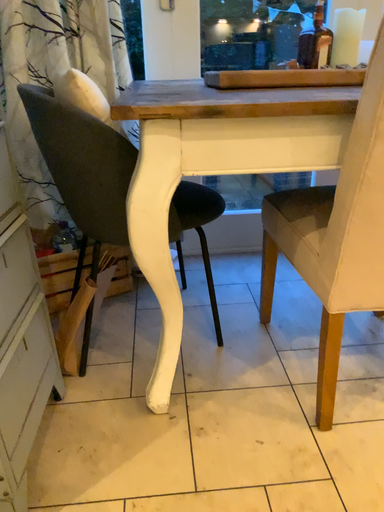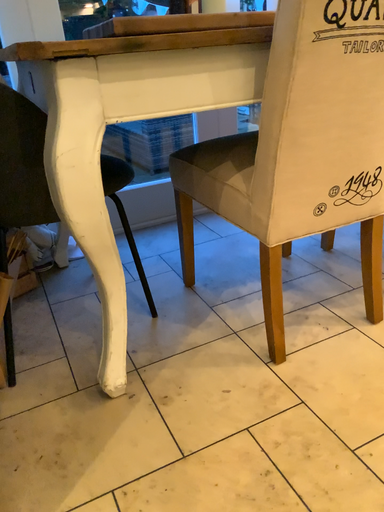
Question: Which way did the camera rotate in the video?

Choices:
 (A) rotated right
 (B) rotated left

Answer: (A)